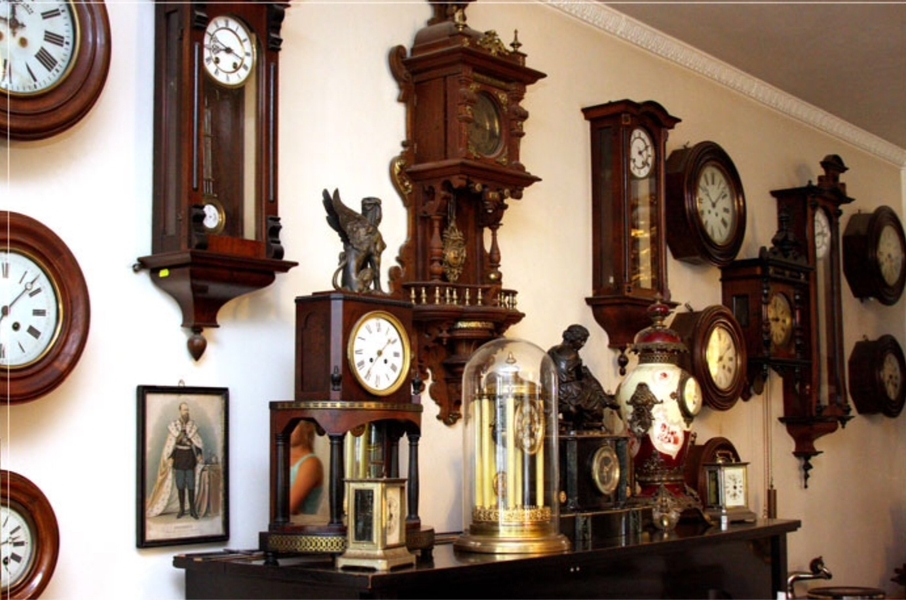
Where is `clocks with circle shape on wall`? clocks with circle shape on wall is located at coordinates (54, 552), (66, 345), (87, 37), (686, 188), (697, 328), (869, 237), (869, 381), (706, 449).